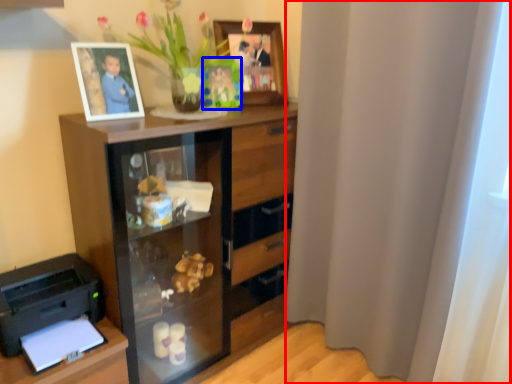
Question: Which object is further to the camera taking this photo, curtain (highlighted by a red box) or picture frame (highlighted by a blue box)?

Choices:
 (A) curtain
 (B) picture frame

Answer: (B)